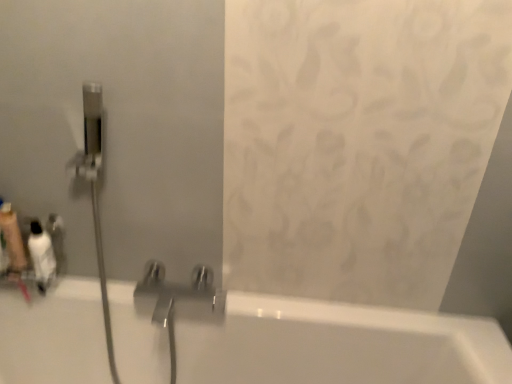
Question: Considering the positions of white glossy bottle at left, the second toiletry when ordered from left to right, and translucent plastic soap dispenser at left, arranged as the 2th toiletry when viewed from the right, in the image, is white glossy bottle at left, the second toiletry when ordered from left to right, wider or thinner than translucent plastic soap dispenser at left, arranged as the 2th toiletry when viewed from the right,?

Choices:
 (A) wide
 (B) thin

Answer: (A)

Question: From a real-world perspective, relative to translucent plastic soap dispenser at left, arranged as the 1th toiletry when viewed from the left, is white glossy bottle at left, marked as the 1th toiletry in a right-to-left arrangement, vertically above or below?

Choices:
 (A) above
 (B) below

Answer: (B)

Question: Choose the correct answer: Is white glossy bottle at left, marked as the 1th toiletry in a right-to-left arrangement, inside translucent plastic soap dispenser at left, arranged as the 1th toiletry when viewed from the left, or outside it?

Choices:
 (A) outside
 (B) inside

Answer: (A)

Question: Considering the positions of translucent plastic soap dispenser at left, arranged as the 1th toiletry when viewed from the left, and white glossy bottle at left, the second toiletry when ordered from left to right, in the image, is translucent plastic soap dispenser at left, arranged as the 1th toiletry when viewed from the left, taller or shorter than white glossy bottle at left, the second toiletry when ordered from left to right,?

Choices:
 (A) short
 (B) tall

Answer: (B)

Question: Does point (22, 264) appear closer or farther from the camera than point (47, 236)?

Choices:
 (A) farther
 (B) closer

Answer: (A)

Question: Is translucent plastic soap dispenser at left, arranged as the 1th toiletry when viewed from the left, situated inside white glossy bottle at left, the second toiletry when ordered from left to right, or outside?

Choices:
 (A) inside
 (B) outside

Answer: (B)

Question: Considering the relative positions of translucent plastic soap dispenser at left, arranged as the 1th toiletry when viewed from the left, and white glossy bottle at left, the second toiletry when ordered from left to right, in the image provided, is translucent plastic soap dispenser at left, arranged as the 1th toiletry when viewed from the left, to the left or to the right of white glossy bottle at left, the second toiletry when ordered from left to right,?

Choices:
 (A) left
 (B) right

Answer: (A)